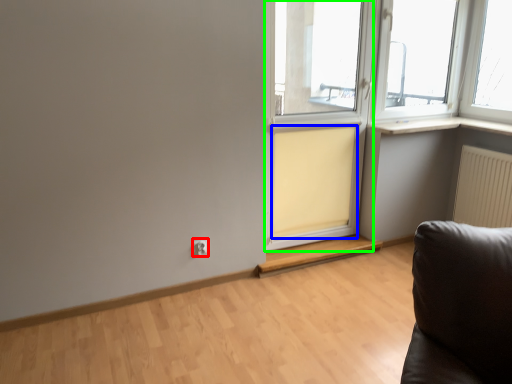
Question: Which is nearer to the electric outlet (highlighted by a red box)? curtain (highlighted by a blue box) or screen door (highlighted by a green box).

Choices:
 (A) curtain
 (B) screen door

Answer: (A)